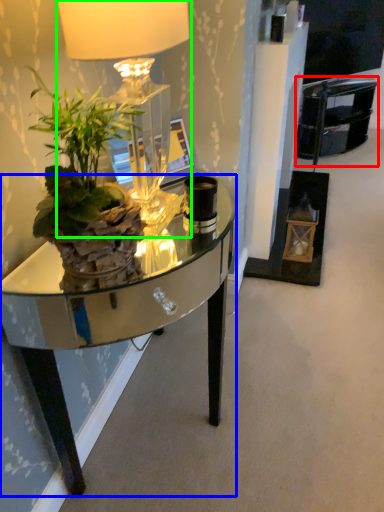
Question: Considering the real-world distances, which object is closest to armchair (highlighted by a red box)? desk (highlighted by a blue box) or lamp (highlighted by a green box).

Choices:
 (A) desk
 (B) lamp

Answer: (B)